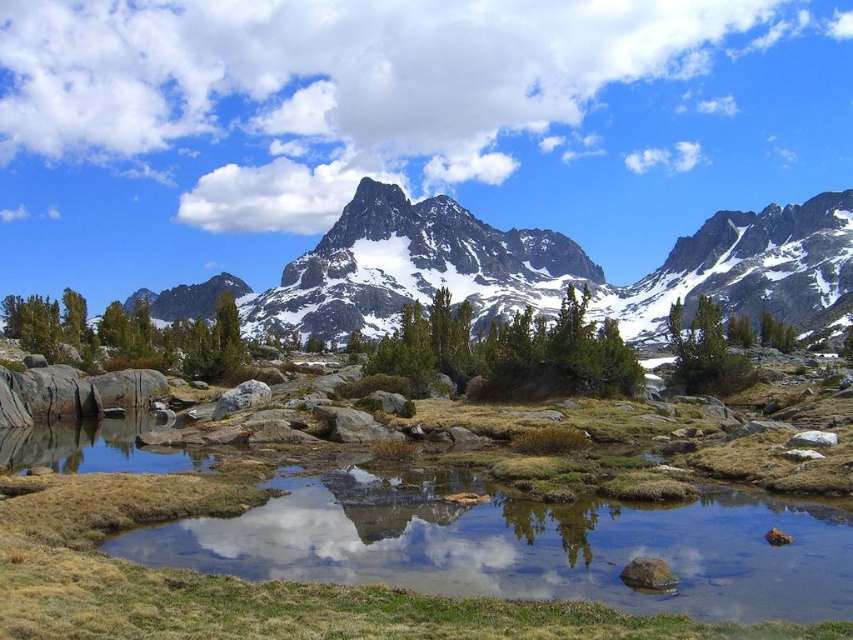
You are a hiker standing at the edge of the pond and you want to take a photo of the green matte shrub at center and the green matte tree at left. Which one will appear larger in your photo?

The green matte shrub at center will appear larger in the photo because it is closer to the viewer than the green matte tree at left.

You are a hiker who wants to take a photo of the green matte tree at left and the green matte tree at center from a position where both are visible in the frame. Based on their positions, which tree should you focus on first to ensure both are in the shot?

The green matte tree at left is located above the green matte tree at center, so you should focus on the green matte tree at center first to ensure both are visible in the frame.

You are a hiker standing at the edge of the pond and looking towards the mountains. You see the green matte shrub at center and the green matte tree at left. Which one is closer to you?

The green matte shrub at center is closer to you because it is positioned below the green matte tree at left, indicating it is in a lower elevation area nearer to your current position at the pond.